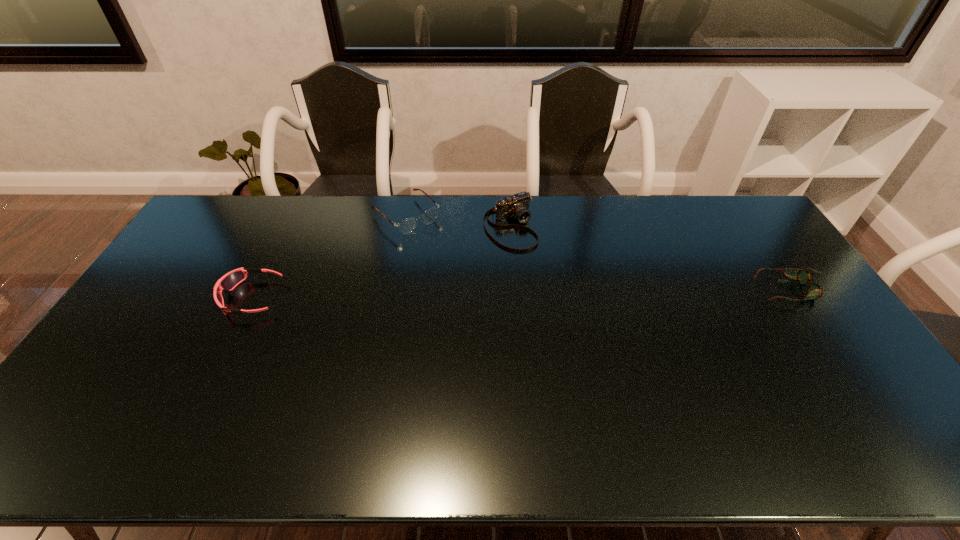
Select which object is the second closest to the left spectacles. Please provide its 2D coordinates. Your answer should be formatted as a tuple, i.e. [(x, y)], where the tuple contains the x and y coordinates of a point satisfying the conditions above.

[(229, 281)]

Where is `free spot that satisfies the following two spatial constraints: 1. on the front side of the third object from right to left; 2. on the front-facing side of the shorter spectacles`? This screenshot has width=960, height=540. free spot that satisfies the following two spatial constraints: 1. on the front side of the third object from right to left; 2. on the front-facing side of the shorter spectacles is located at coordinates coord(392,289).

Find the location of a particular element. The image size is (960, 540). vacant space that satisfies the following two spatial constraints: 1. on the front side of the third object from right to left; 2. on the left side of the third object from left to right is located at coordinates (x=404, y=226).

Locate an element on the screen. vacant space that satisfies the following two spatial constraints: 1. on the front side of the third object from right to left; 2. on the front-facing side of the right spectacles is located at coordinates (392, 289).